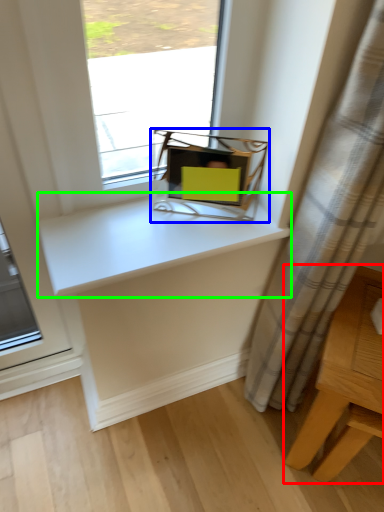
Question: Considering the real-world distances, which object is closest to table (highlighted by a red box)? equipment (highlighted by a blue box) or counter top (highlighted by a green box).

Choices:
 (A) equipment
 (B) counter top

Answer: (B)